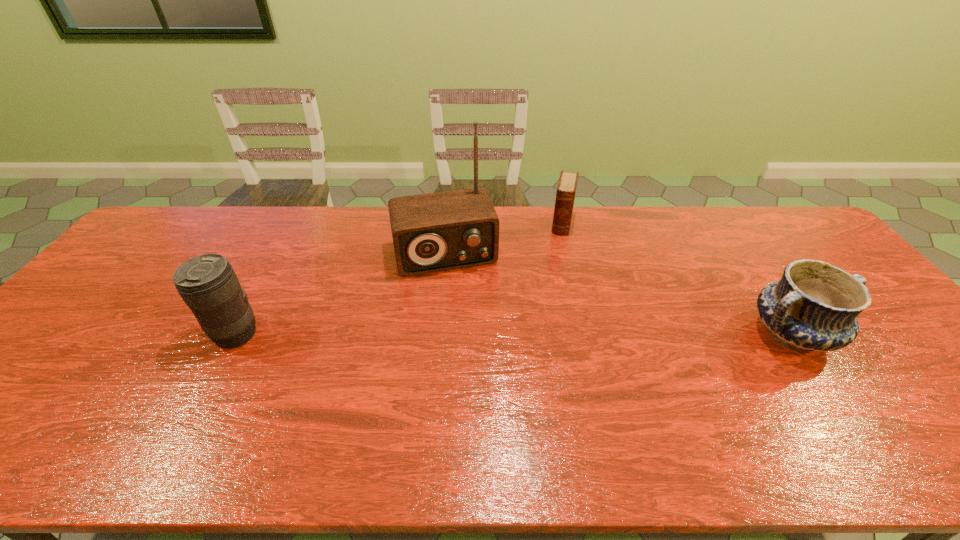
In the image, there is a desktop. Identify the location of free space at the left edge. (59, 348).

Where is `vacant area at the right edge`? vacant area at the right edge is located at coordinates (867, 338).

At what (x,y) coordinates should I click in order to perform the action: click on free space at the far left corner. Please return your answer as a coordinate pair (x, y). The width and height of the screenshot is (960, 540). Looking at the image, I should click on (207, 207).

Find the location of a particular element. free space at the near left corner of the desktop is located at coordinates (1, 403).

In order to click on vacant space at the near right corner of the desktop in this screenshot , I will do `click(907, 410)`.

The image size is (960, 540). I want to click on blank region between the second tallest object and the third object from right to left, so click(x=340, y=294).

Identify the location of vacant space that's between the pottery and the second object from right to left. (677, 279).

Locate an element on the screen. free space between the diary and the leftmost object is located at coordinates (398, 279).

Image resolution: width=960 pixels, height=540 pixels. Identify the location of vacant space that's between the tallest object and the third shortest object. (340, 294).

What are the coordinates of `blank region between the rightmost object and the second object from right to left` in the screenshot? It's located at (677, 279).